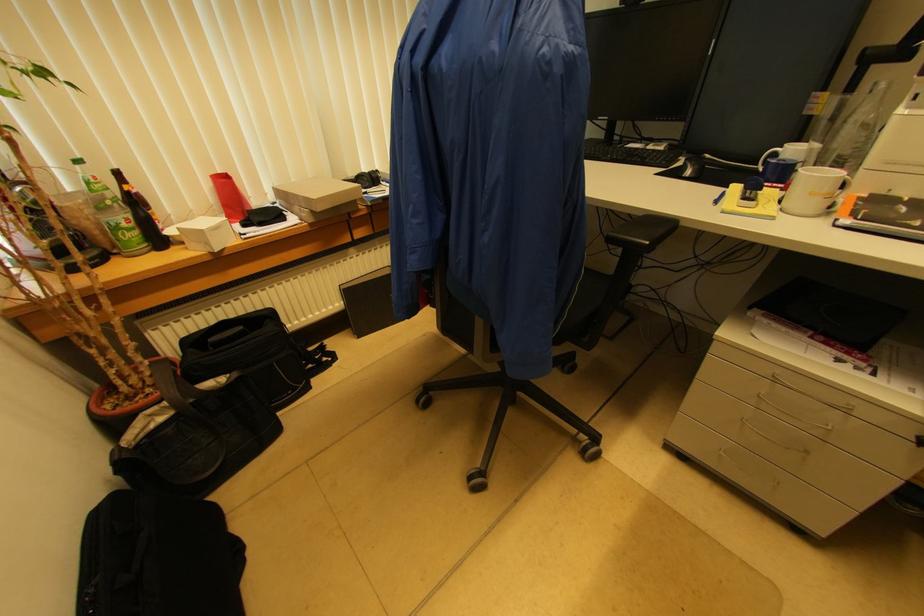
Where would you lift the green plastic bottle? Please return your answer as a coordinate pair (x, y).

(111, 212)